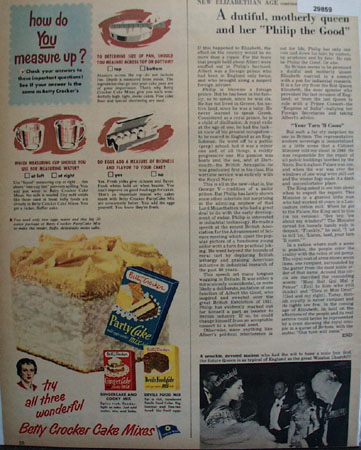
I want to click on box, so click(123, 378), click(158, 385), click(152, 316).